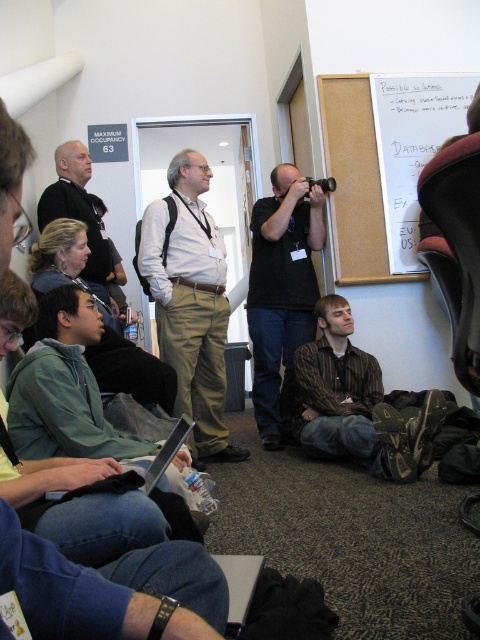
You are standing in the room and want to find the point at coordinates (x=357, y=403). Which object in the scene is this point located on?

The point at coordinates (x=357, y=403) is located on the brown striped shirt at lower center.

You are a photographer standing in the room. You want to take a photo of the green fabric jacket at lower left and the brown striped shirt at lower center. Which one is covering the other?

The green fabric jacket at lower left is positioned over brown striped shirt at lower center, so it is covering the brown striped shirt at lower center.